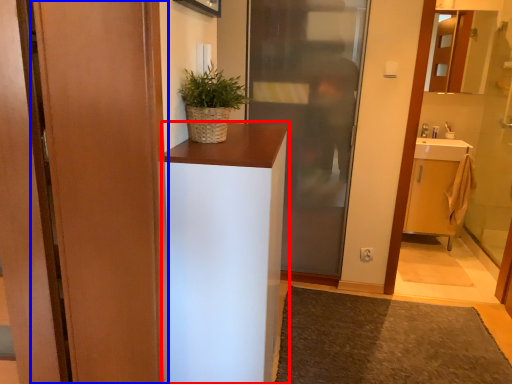
Question: Which object is further to the camera taking this photo, cabinetry (highlighted by a red box) or door (highlighted by a blue box)?

Choices:
 (A) cabinetry
 (B) door

Answer: (A)